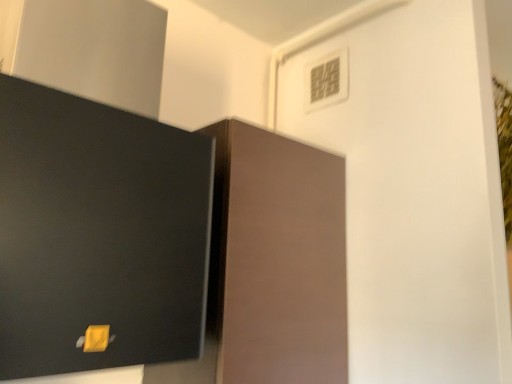
This screenshot has width=512, height=384. I want to click on matte brown cabinet at center, so click(276, 260).

The height and width of the screenshot is (384, 512). What do you see at coordinates (276, 260) in the screenshot?
I see `matte brown cabinet at center` at bounding box center [276, 260].

This screenshot has height=384, width=512. I want to click on white plastic light switch at upper center, so click(x=326, y=80).

Describe the element at coordinates (326, 80) in the screenshot. This screenshot has height=384, width=512. I see `white plastic light switch at upper center` at that location.

This screenshot has height=384, width=512. In order to click on matte brown cabinet at center in this screenshot , I will do `click(276, 260)`.

Considering the positions of objects white plastic light switch at upper center and matte brown cabinet at center in the image provided, who is more to the right, white plastic light switch at upper center or matte brown cabinet at center?

From the viewer's perspective, white plastic light switch at upper center appears more on the right side.

Is white plastic light switch at upper center in front of or behind matte brown cabinet at center in the image?

Visually, white plastic light switch at upper center is located behind matte brown cabinet at center.

Considering the positions of point (323, 62) and point (315, 241), is point (323, 62) closer or farther from the camera than point (315, 241)?

Point (323, 62).

From the image's perspective, which one is positioned higher, white plastic light switch at upper center or matte brown cabinet at center?

white plastic light switch at upper center.

From a real-world perspective, is white plastic light switch at upper center physically above matte brown cabinet at center?

Yes, from a real-world perspective, white plastic light switch at upper center is on top of matte brown cabinet at center.

Which of these two, white plastic light switch at upper center or matte brown cabinet at center, is wider?

With larger width is matte brown cabinet at center.

Considering the sizes of objects white plastic light switch at upper center and matte brown cabinet at center in the image provided, who is shorter, white plastic light switch at upper center or matte brown cabinet at center?

A: Standing shorter between the two is white plastic light switch at upper center.

Which of these two, white plastic light switch at upper center or matte brown cabinet at center, is bigger?

matte brown cabinet at center is bigger.

In the scene shown: Is white plastic light switch at upper center positioned beyond the bounds of matte brown cabinet at center?

That's correct, white plastic light switch at upper center is outside of matte brown cabinet at center.

Would you say white plastic light switch at upper center is a long distance from matte brown cabinet at center?

They are positioned close to each other.

Is white plastic light switch at upper center positioned with its back to matte brown cabinet at center?

No, matte brown cabinet at center is not at the back of white plastic light switch at upper center.

How different are the orientations of white plastic light switch at upper center and matte brown cabinet at center in degrees?

There is a 93.4-degree angle between the facing directions of white plastic light switch at upper center and matte brown cabinet at center.

Image resolution: width=512 pixels, height=384 pixels. I want to click on light switch to the right of matte brown cabinet at center, so click(326, 80).

Can you confirm if matte brown cabinet at center is positioned to the left of white plastic light switch at upper center?

Yes.

Is matte brown cabinet at center positioned in front of white plastic light switch at upper center?

Yes, matte brown cabinet at center is in front of white plastic light switch at upper center.

Considering the positions of point (226, 186) and point (339, 88), is point (226, 186) closer or farther from the camera than point (339, 88)?

Point (226, 186) is positioned closer to the camera compared to point (339, 88).

From the image's perspective, which object appears higher, matte brown cabinet at center or white plastic light switch at upper center?

white plastic light switch at upper center appears higher in the image.

From a real-world perspective, who is located lower, matte brown cabinet at center or white plastic light switch at upper center?

In real-world perspective, matte brown cabinet at center is lower.

Can you confirm if matte brown cabinet at center is thinner than white plastic light switch at upper center?

No.

Who is shorter, matte brown cabinet at center or white plastic light switch at upper center?

With less height is white plastic light switch at upper center.

Is matte brown cabinet at center bigger than white plastic light switch at upper center?

Yes.

Would you say matte brown cabinet at center is outside white plastic light switch at upper center?

matte brown cabinet at center lies outside white plastic light switch at upper center's area.

Is matte brown cabinet at center not near white plastic light switch at upper center?

Actually, matte brown cabinet at center and white plastic light switch at upper center are a little close together.

Is matte brown cabinet at center aimed at white plastic light switch at upper center?

No, matte brown cabinet at center does not turn towards white plastic light switch at upper center.

How many degrees apart are the facing directions of matte brown cabinet at center and white plastic light switch at upper center?

The angular difference between matte brown cabinet at center and white plastic light switch at upper center is 93.4 degrees.

Where is `light switch on the right side of matte brown cabinet at center`? light switch on the right side of matte brown cabinet at center is located at coordinates (326, 80).

The image size is (512, 384). I want to click on light switch that is behind the matte brown cabinet at center, so click(x=326, y=80).

Locate an element on the screen. Image resolution: width=512 pixels, height=384 pixels. light switch above the matte brown cabinet at center (from the image's perspective) is located at coordinates (326, 80).